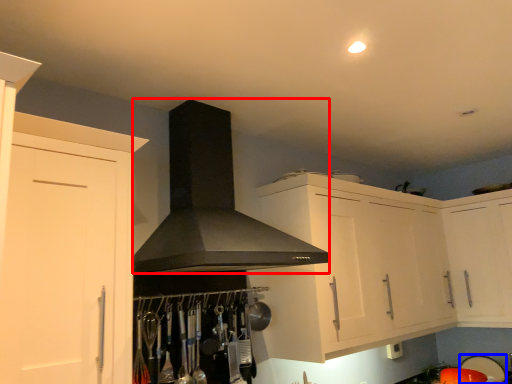
Question: Which of the following is the closest to the observer, fume hood (highlighted by a red box) or appliance (highlighted by a blue box)?

Choices:
 (A) fume hood
 (B) appliance

Answer: (A)